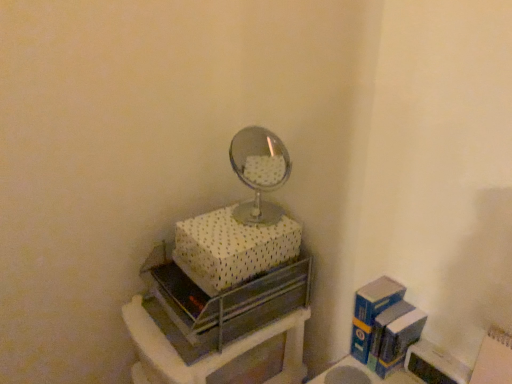
Question: From a real-world perspective, is metallic silver drawer at center positioned under white dotted fabric box at upper center, the 1th box from the top, based on gravity?

Choices:
 (A) no
 (B) yes

Answer: (B)

Question: Is metallic silver drawer at center oriented away from white dotted fabric box at upper center, the second box in the right-to-left sequence?

Choices:
 (A) no
 (B) yes

Answer: (A)

Question: Is metallic silver drawer at center located outside white dotted fabric box at upper center, the 1th box from the top?

Choices:
 (A) yes
 (B) no

Answer: (A)

Question: Considering the relative sizes of metallic silver drawer at center and white dotted fabric box at upper center, which is the 1th box from left to right, in the image provided, is metallic silver drawer at center shorter than white dotted fabric box at upper center, which is the 1th box from left to right,?

Choices:
 (A) no
 (B) yes

Answer: (A)

Question: Is metallic silver drawer at center surrounding white dotted fabric box at upper center, the second box in the right-to-left sequence?

Choices:
 (A) yes
 (B) no

Answer: (B)

Question: Is blue cardboard box at right, the first box when ordered from right to left, to the left or to the right of white dotted fabric box at upper center, the 1th box from the top, in the image?

Choices:
 (A) right
 (B) left

Answer: (A)

Question: In the image, is blue cardboard box at right, the second box from the top, positioned in front of or behind white dotted fabric box at upper center, the second box in the right-to-left sequence?

Choices:
 (A) front
 (B) behind

Answer: (B)

Question: Would you say blue cardboard box at right, the first box when ordered from right to left, is inside or outside white dotted fabric box at upper center, the second box in the right-to-left sequence?

Choices:
 (A) inside
 (B) outside

Answer: (B)

Question: From the image's perspective, is blue cardboard box at right, the 2th box from the left, above or below white dotted fabric box at upper center, which is the 1th box from left to right?

Choices:
 (A) below
 (B) above

Answer: (A)

Question: Based on their positions, is white dotted fabric box at upper center, which appears as the second box when ordered from the bottom, located to the left or right of metallic silver drawer at center?

Choices:
 (A) right
 (B) left

Answer: (A)

Question: Is point (229, 269) closer or farther from the camera than point (248, 344)?

Choices:
 (A) closer
 (B) farther

Answer: (A)

Question: In terms of width, does white dotted fabric box at upper center, the 1th box from the top, look wider or thinner when compared to metallic silver drawer at center?

Choices:
 (A) thin
 (B) wide

Answer: (A)

Question: From the image's perspective, is white dotted fabric box at upper center, which is the 1th box from left to right, positioned above or below metallic silver drawer at center?

Choices:
 (A) above
 (B) below

Answer: (A)

Question: Would you say metallic silver drawer at center is inside or outside white dotted fabric box at upper center, which is the 1th box from left to right?

Choices:
 (A) outside
 (B) inside

Answer: (A)

Question: Is metallic silver drawer at center taller or shorter than white dotted fabric box at upper center, the second box in the right-to-left sequence?

Choices:
 (A) short
 (B) tall

Answer: (B)